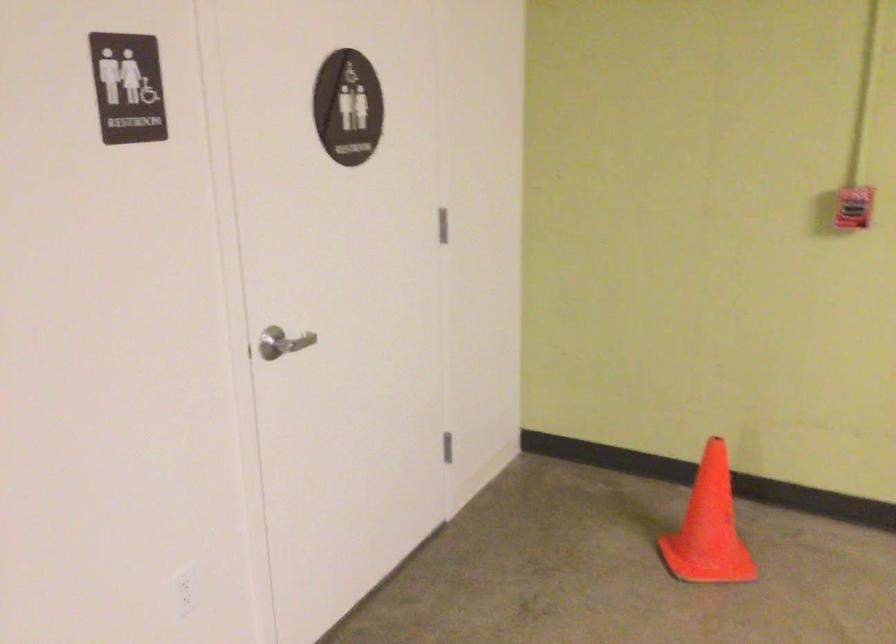
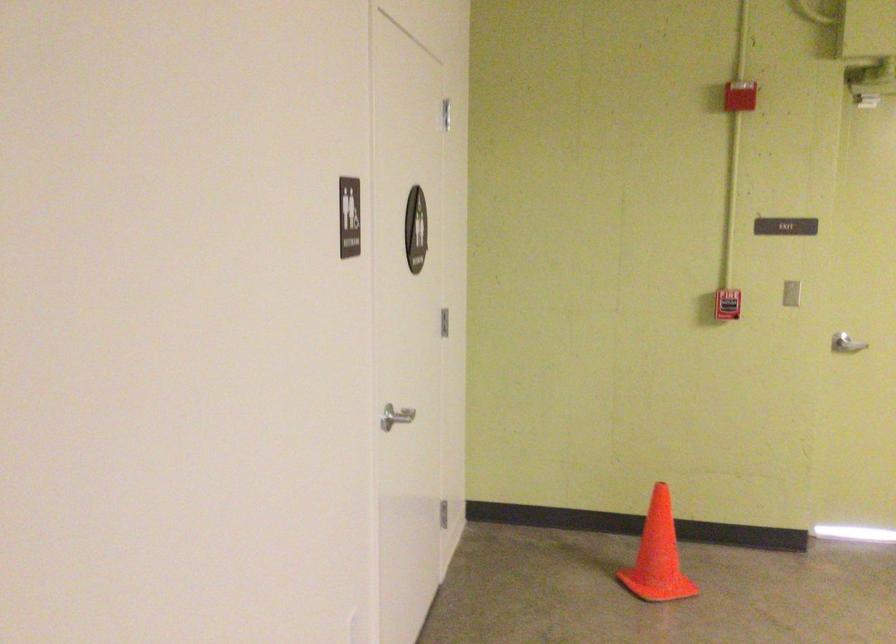
Where in the second image is the point corresponding to point (693, 525) from the first image?

(658, 556)